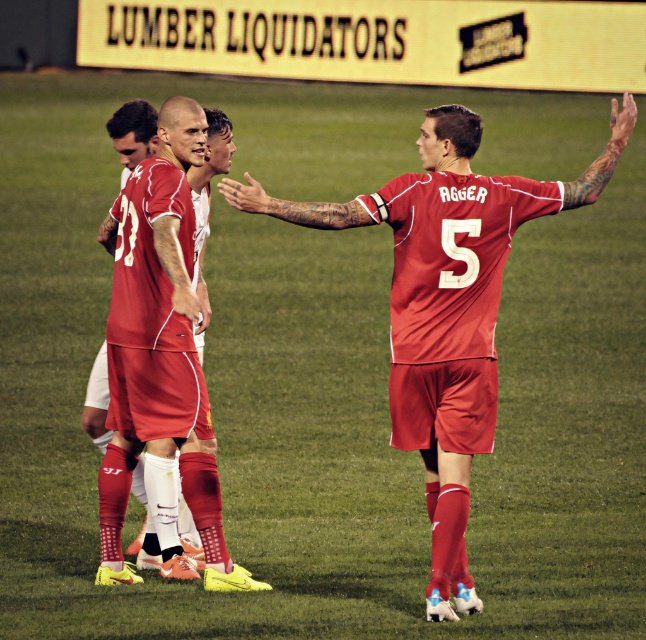
Question: Considering the relative positions of matte red jersey at center and matte red soccer uniform at center in the image provided, where is matte red jersey at center located with respect to matte red soccer uniform at center?

Choices:
 (A) below
 (B) above

Answer: (B)

Question: Considering the relative positions of matte red jersey at center and matte red soccer uniform at center in the image provided, where is matte red jersey at center located with respect to matte red soccer uniform at center?

Choices:
 (A) below
 (B) above

Answer: (B)

Question: Is matte red jersey at center behind matte red soccer uniform at center?

Choices:
 (A) yes
 (B) no

Answer: (B)

Question: Which point is closer to the camera?

Choices:
 (A) matte red jersey at center
 (B) matte red soccer uniform at center

Answer: (A)

Question: Among these points, which one is nearest to the camera?

Choices:
 (A) (339, 218)
 (B) (134, 579)

Answer: (A)